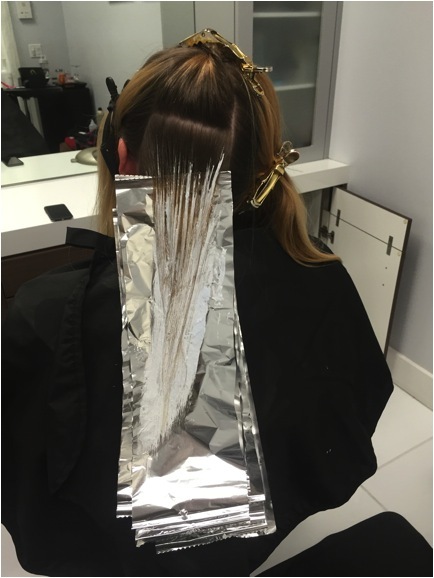
The height and width of the screenshot is (578, 434). Find the location of `cabinet door`. cabinet door is located at coordinates (355, 234).